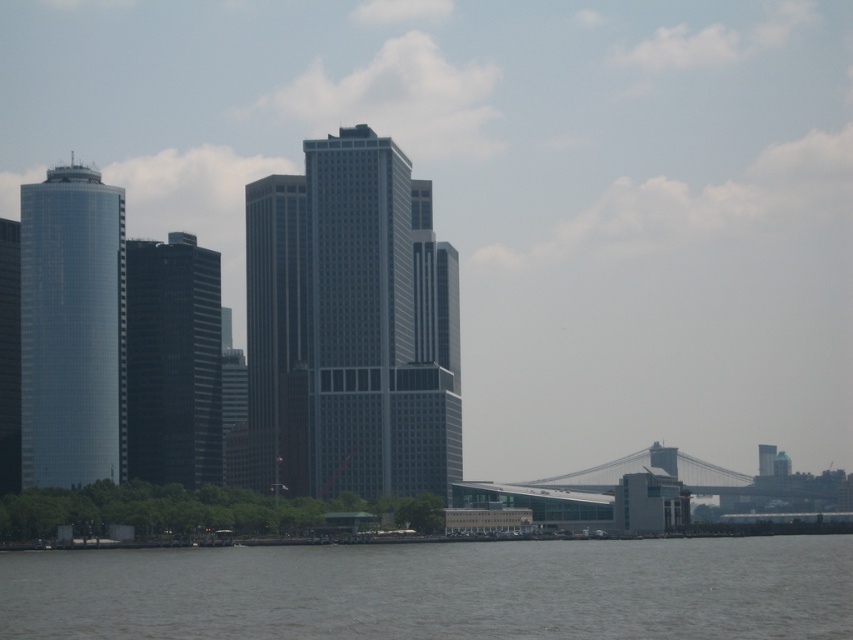
Question: Where is gray water at lower center located in relation to shiny glass tower at left in the image?

Choices:
 (A) below
 (B) above

Answer: (A)

Question: Which point appears closest to the camera in this image?

Choices:
 (A) pyautogui.click(x=296, y=348)
 (B) pyautogui.click(x=445, y=324)
 (C) pyautogui.click(x=173, y=465)
 (D) pyautogui.click(x=670, y=620)

Answer: (B)

Question: Among these points, which one is nearest to the camera?

Choices:
 (A) (80, 620)
 (B) (142, 292)

Answer: (B)

Question: Observing the image, what is the correct spatial positioning of shiny glass tower at left in reference to dark gray glass skyscraper at center?

Choices:
 (A) left
 (B) right

Answer: (A)

Question: Which point appears farthest from the camera in this image?

Choices:
 (A) (672, 627)
 (B) (328, 483)
 (C) (157, 312)

Answer: (A)

Question: Can you confirm if shiny glass tower at left is positioned below dark gray glass skyscraper at center?

Choices:
 (A) no
 (B) yes

Answer: (A)